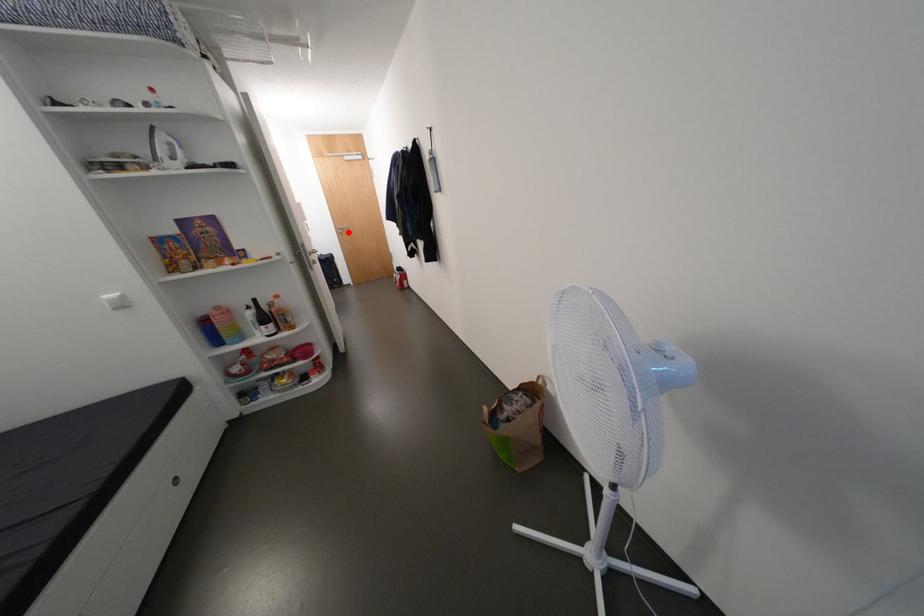
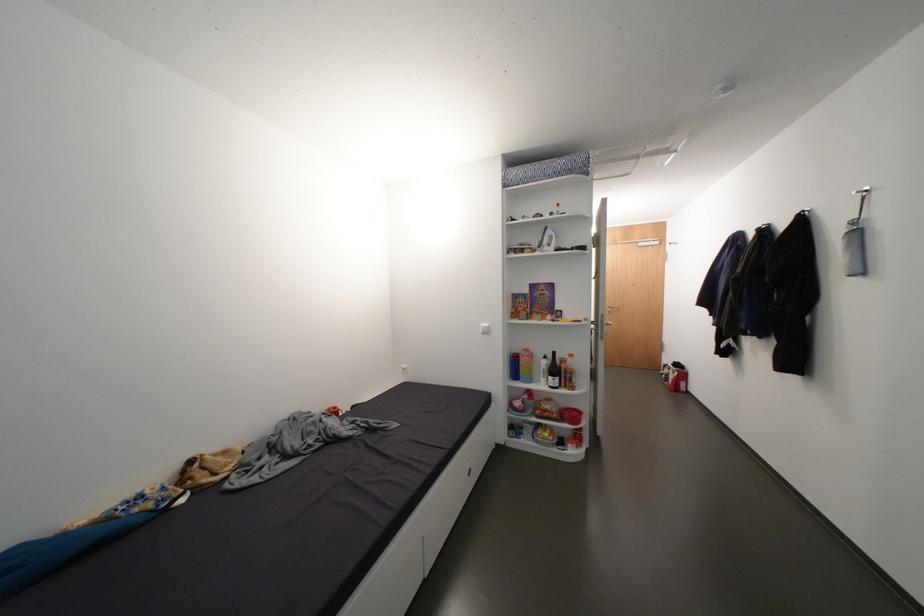
Question: I am providing you with two images of the same scene from different viewpoints. Image1 has a red point marked. In image2, the corresponding 3D location appears at what relative position? Reply with the corresponding letter.

Choices:
 (A) Closer
 (B) Farther

Answer: (B)